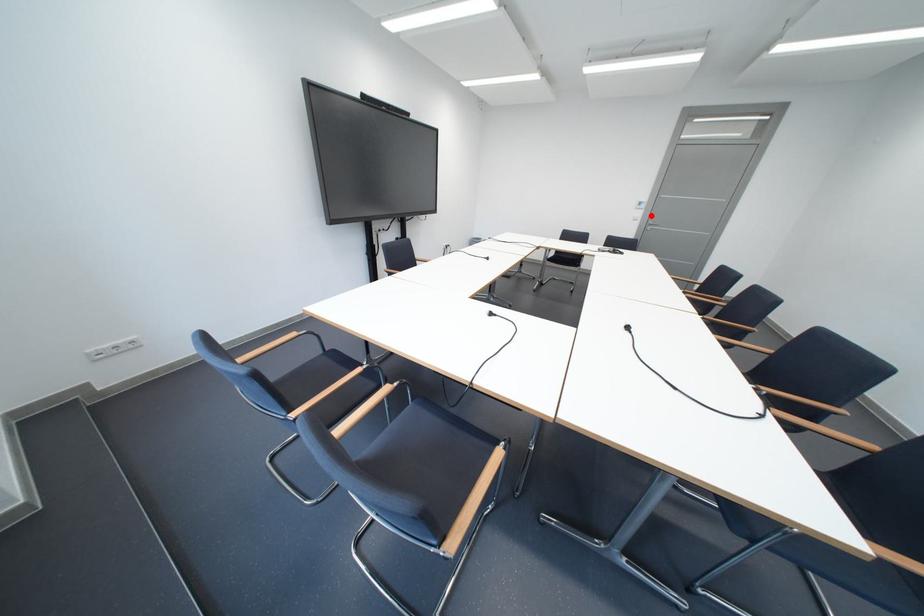
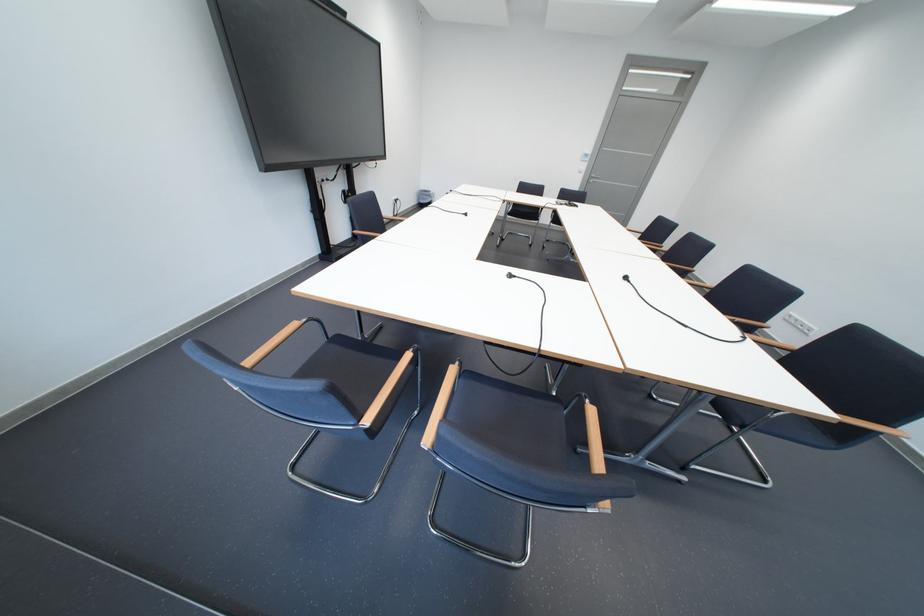
Find the pixel in the second image that matches the highlighted location in the first image.

(596, 168)